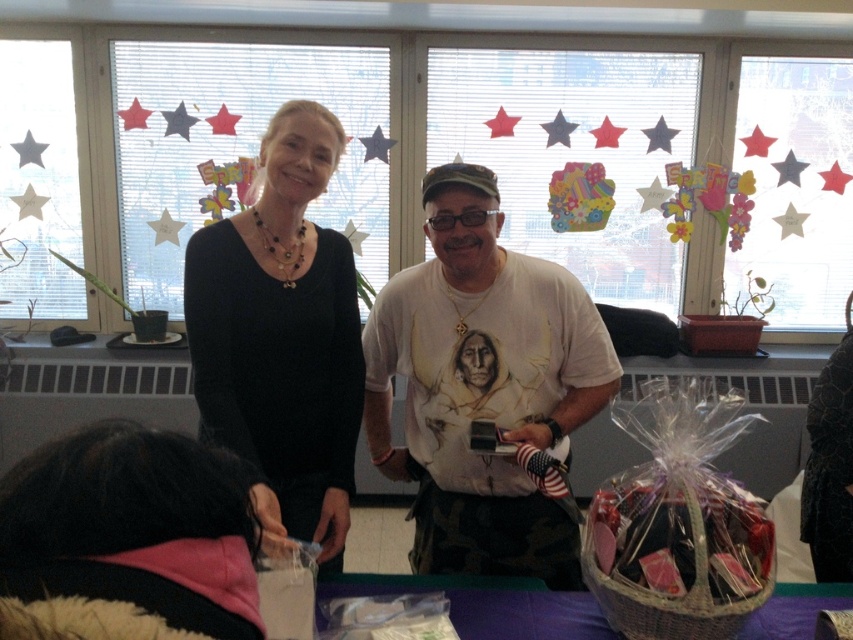
Is point (497, 253) positioned after point (209, 632)?

Yes.

Between point (386, 337) and point (202, 625), which one is positioned behind?

The point (386, 337) is more distant.

The image size is (853, 640). In order to click on white t-shirt at center in this screenshot , I will do `click(482, 385)`.

Is point (573, 294) behind point (595, 580)?

Yes, it is behind point (595, 580).

Can you confirm if white t-shirt at center is shorter than matte wicker basket at lower right?

Incorrect, white t-shirt at center's height does not fall short of matte wicker basket at lower right's.

Who is more forward, (467, 282) or (770, 589)?

Positioned in front is point (770, 589).

At what (x,y) coordinates should I click in order to perform the action: click on white t-shirt at center. Please return your answer as a coordinate pair (x, y). Looking at the image, I should click on (482, 385).

Who is higher up, black matte sweater at upper center or pink fleece scarf at lower left?

black matte sweater at upper center is higher up.

Is black matte sweater at upper center to the left of pink fleece scarf at lower left from the viewer's perspective?

Correct, you'll find black matte sweater at upper center to the left of pink fleece scarf at lower left.

I want to click on black matte sweater at upper center, so click(282, 337).